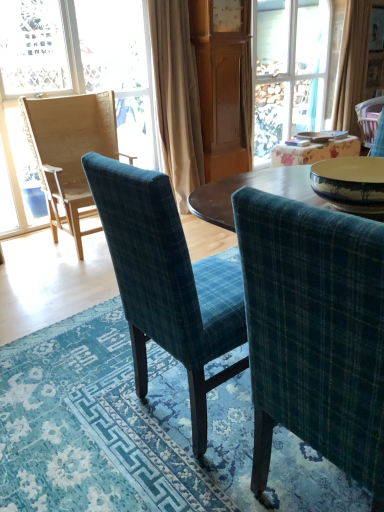
Question: From a real-world perspective, is blue textured rug at center below wooden chair at left?

Choices:
 (A) yes
 (B) no

Answer: (A)

Question: Is blue textured rug at center surrounding wooden chair at left?

Choices:
 (A) no
 (B) yes

Answer: (A)

Question: Is blue textured rug at center at the right side of wooden chair at left?

Choices:
 (A) no
 (B) yes

Answer: (B)

Question: Can you confirm if blue textured rug at center is thinner than wooden chair at left?

Choices:
 (A) yes
 (B) no

Answer: (B)

Question: Is blue textured rug at center positioned with its back to wooden chair at left?

Choices:
 (A) yes
 (B) no

Answer: (B)

Question: Is wooden table at center in front of or behind gold textured curtain at upper right, positioned as the first curtain in right-to-left order, in the image?

Choices:
 (A) front
 (B) behind

Answer: (A)

Question: Considering the positions of wooden table at center and gold textured curtain at upper right, which is counted as the second curtain, starting from the left, in the image, is wooden table at center bigger or smaller than gold textured curtain at upper right, which is counted as the second curtain, starting from the left,?

Choices:
 (A) big
 (B) small

Answer: (B)

Question: Is wooden table at center wider or thinner than gold textured curtain at upper right, which is counted as the second curtain, starting from the left?

Choices:
 (A) thin
 (B) wide

Answer: (B)

Question: From the image's perspective, is wooden table at center located above or below gold textured curtain at upper right, positioned as the first curtain in right-to-left order?

Choices:
 (A) below
 (B) above

Answer: (A)

Question: In the image, is woven wood chair at left, positioned as the 4th chair in right-to-left order, positioned in front of or behind teal plaid chair at center, which is the 4th chair from back to front?

Choices:
 (A) front
 (B) behind

Answer: (B)

Question: In terms of height, does woven wood chair at left, positioned as the 4th chair in right-to-left order, look taller or shorter compared to teal plaid chair at center, which appears as the first chair when viewed from the front?

Choices:
 (A) tall
 (B) short

Answer: (A)

Question: Is woven wood chair at left, positioned as the 4th chair in right-to-left order, situated inside teal plaid chair at center, which appears as the first chair when viewed from the front, or outside?

Choices:
 (A) outside
 (B) inside

Answer: (A)

Question: From the image's perspective, is woven wood chair at left, the first chair from the left, located above or below teal plaid chair at center, the 2th chair in the right-to-left sequence?

Choices:
 (A) below
 (B) above

Answer: (B)

Question: Considering the positions of wooden chair at left and wooden table at center in the image, is wooden chair at left wider or thinner than wooden table at center?

Choices:
 (A) wide
 (B) thin

Answer: (B)

Question: Is point (16, 164) closer or farther from the camera than point (274, 152)?

Choices:
 (A) closer
 (B) farther

Answer: (A)